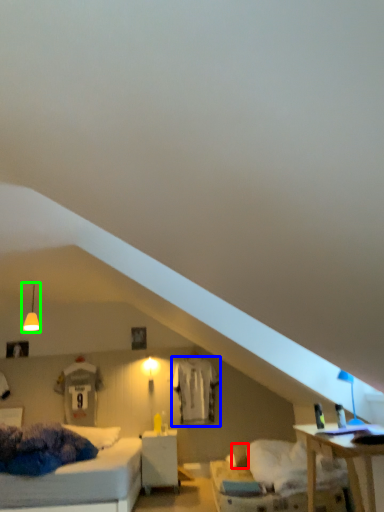
Question: Which is nearer to the pillow (highlighted by a red box)? sheet (highlighted by a blue box) or fixture (highlighted by a green box).

Choices:
 (A) sheet
 (B) fixture

Answer: (A)